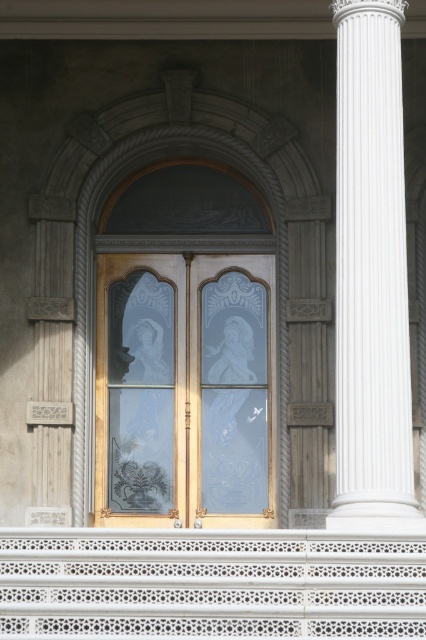
Question: Does white lace balustrade at lower center lie in front of white marble column at right?

Choices:
 (A) yes
 (B) no

Answer: (A)

Question: In this image, where is clear glass window at center located relative to white lace balustrade at lower center?

Choices:
 (A) left
 (B) right

Answer: (B)

Question: Which object appears farthest from the camera in this image?

Choices:
 (A) white lace balustrade at lower center
 (B) white marble column at right

Answer: (B)

Question: Which point is closer to the camera taking this photo?

Choices:
 (A) (348, 1)
 (B) (16, 592)

Answer: (B)

Question: Which object appears farthest from the camera in this image?

Choices:
 (A) clear glass window at center
 (B) white marble column at right
 (C) white lace balustrade at lower center

Answer: (A)

Question: Is white lace balustrade at lower center positioned at the back of white marble column at right?

Choices:
 (A) yes
 (B) no

Answer: (B)